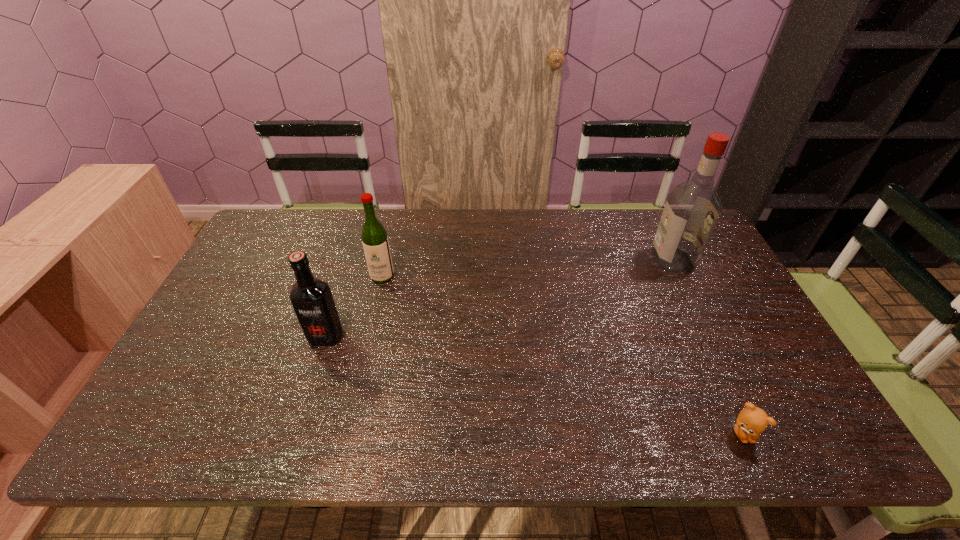
I want to click on free space between the rightmost liquor and the nearest object, so click(x=708, y=347).

Where is `vacant region between the rightmost liquor and the third farthest object`? vacant region between the rightmost liquor and the third farthest object is located at coordinates (499, 298).

Identify which object is located as the second nearest to the third object from right to left. Please provide its 2D coordinates. Your answer should be formatted as a tuple, i.e. [(x, y)], where the tuple contains the x and y coordinates of a point satisfying the conditions above.

[(692, 208)]

Identify which object is the second nearest to the rightmost liquor. Please provide its 2D coordinates. Your answer should be formatted as a tuple, i.e. [(x, y)], where the tuple contains the x and y coordinates of a point satisfying the conditions above.

[(375, 242)]

Identify which liquor is located as the third nearest to the teddy bear. Please provide its 2D coordinates. Your answer should be formatted as a tuple, i.e. [(x, y)], where the tuple contains the x and y coordinates of a point satisfying the conditions above.

[(312, 300)]

Locate an element on the screen. liquor that is the second nearest to the teddy bear is located at coordinates (375, 242).

What are the coordinates of `vacant point that satisfies the following two spatial constraints: 1. on the front-facing side of the rightmost liquor; 2. on the face of the shortest object` in the screenshot? It's located at (757, 434).

Locate an element on the screen. vacant space that satisfies the following two spatial constraints: 1. on the front-facing side of the rightmost liquor; 2. on the front-facing side of the second nearest object is located at coordinates (x=710, y=336).

This screenshot has height=540, width=960. I want to click on vacant space that satisfies the following two spatial constraints: 1. on the front-facing side of the tallest object; 2. on the face of the shortest object, so click(757, 434).

At what (x,y) coordinates should I click in order to perform the action: click on vacant space that satisfies the following two spatial constraints: 1. on the front-facing side of the tallest object; 2. on the front-facing side of the second nearest object. Please return your answer as a coordinate pair (x, y). The image size is (960, 540). Looking at the image, I should click on (710, 336).